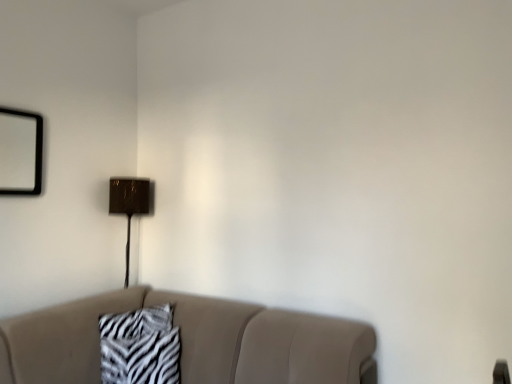
What do you see at coordinates (190, 342) in the screenshot?
I see `beige fabric couch at lower center` at bounding box center [190, 342].

The width and height of the screenshot is (512, 384). Identify the location of metallic gold table lamp at upper center. (129, 205).

How far apart are beige fabric couch at lower center and metallic gold table lamp at upper center?

A distance of 31.84 inches exists between beige fabric couch at lower center and metallic gold table lamp at upper center.

From the picture: From a real-world perspective, is beige fabric couch at lower center beneath metallic gold table lamp at upper center?

Yes.

Are beige fabric couch at lower center and metallic gold table lamp at upper center located far from each other?

Actually, beige fabric couch at lower center and metallic gold table lamp at upper center are a little close together.

Does zebra-patterned fabric at center have a smaller size compared to beige fabric couch at lower center?

Yes, zebra-patterned fabric at center is smaller than beige fabric couch at lower center.

Choose the correct answer: Is zebra-patterned fabric at center inside beige fabric couch at lower center or outside it?

zebra-patterned fabric at center is enclosed within beige fabric couch at lower center.

The height and width of the screenshot is (384, 512). In order to click on studio couch in front of the zebra-patterned fabric at center in this screenshot , I will do `click(190, 342)`.

From the image's perspective, relative to beige fabric couch at lower center, is zebra-patterned fabric at center above or below?

From the image's perspective, zebra-patterned fabric at center appears above beige fabric couch at lower center.

Based on the photo, could you tell me if metallic gold table lamp at upper center is turned towards beige fabric couch at lower center?

No.

From the image's perspective, is metallic gold table lamp at upper center under beige fabric couch at lower center?

No, from the image's perspective, metallic gold table lamp at upper center is not below beige fabric couch at lower center.

Does metallic gold table lamp at upper center have a lesser width compared to beige fabric couch at lower center?

Yes.

Between metallic gold table lamp at upper center and beige fabric couch at lower center, which one appears on the right side from the viewer's perspective?

beige fabric couch at lower center is more to the right.

Could you tell me if zebra-patterned fabric at center is turned towards metallic gold table lamp at upper center?

No, zebra-patterned fabric at center does not turn towards metallic gold table lamp at upper center.

Is zebra-patterned fabric at center bigger or smaller than metallic gold table lamp at upper center?

zebra-patterned fabric at center is smaller than metallic gold table lamp at upper center.

Would you say metallic gold table lamp at upper center is part of zebra-patterned fabric at center's contents?

No, metallic gold table lamp at upper center is not surrounded by zebra-patterned fabric at center.

From the image's perspective, relative to metallic gold table lamp at upper center, is zebra-patterned fabric at center above or below?

zebra-patterned fabric at center is situated lower than metallic gold table lamp at upper center in the image.

From a real-world perspective, is metallic gold table lamp at upper center over zebra-patterned fabric at center?

Yes.

Considering the relative sizes of metallic gold table lamp at upper center and zebra-patterned fabric at center in the image provided, is metallic gold table lamp at upper center thinner than zebra-patterned fabric at center?

Incorrect, the width of metallic gold table lamp at upper center is not less than that of zebra-patterned fabric at center.

Is zebra-patterned fabric at center completely or partially inside metallic gold table lamp at upper center?

No, metallic gold table lamp at upper center does not contain zebra-patterned fabric at center.

Is metallic gold table lamp at upper center bigger than zebra-patterned fabric at center?

Correct, metallic gold table lamp at upper center is larger in size than zebra-patterned fabric at center.

Is beige fabric couch at lower center far away from zebra-patterned fabric at center?

No, beige fabric couch at lower center is in close proximity to zebra-patterned fabric at center.

Visually, is beige fabric couch at lower center positioned to the left or to the right of zebra-patterned fabric at center?

From the image, it's evident that beige fabric couch at lower center is to the right of zebra-patterned fabric at center.

Which object is wider, beige fabric couch at lower center or zebra-patterned fabric at center?

beige fabric couch at lower center is wider.

Considering the sizes of objects beige fabric couch at lower center and zebra-patterned fabric at center in the image provided, who is shorter, beige fabric couch at lower center or zebra-patterned fabric at center?

zebra-patterned fabric at center.

Image resolution: width=512 pixels, height=384 pixels. Find the location of `studio couch below the metallic gold table lamp at upper center (from the image's perspective)`. studio couch below the metallic gold table lamp at upper center (from the image's perspective) is located at coordinates (190, 342).

Find the location of a particular element. The height and width of the screenshot is (384, 512). pillow that appears behind the beige fabric couch at lower center is located at coordinates (140, 347).

Considering their positions, is metallic gold table lamp at upper center positioned closer to beige fabric couch at lower center than zebra-patterned fabric at center?

zebra-patterned fabric at center lies closer to beige fabric couch at lower center than the other object.

Considering their positions, is zebra-patterned fabric at center positioned further to metallic gold table lamp at upper center than beige fabric couch at lower center?

The object further to metallic gold table lamp at upper center is beige fabric couch at lower center.

Estimate the real-world distances between objects in this image. Which object is further from beige fabric couch at lower center, zebra-patterned fabric at center or metallic gold table lamp at upper center?

metallic gold table lamp at upper center is positioned further to the anchor beige fabric couch at lower center.

From the image, which object appears to be farther from zebra-patterned fabric at center, beige fabric couch at lower center or metallic gold table lamp at upper center?

metallic gold table lamp at upper center is further to zebra-patterned fabric at center.

Which object lies nearer to the anchor point metallic gold table lamp at upper center, beige fabric couch at lower center or zebra-patterned fabric at center?

zebra-patterned fabric at center.

Looking at the image, which one is located further to zebra-patterned fabric at center, metallic gold table lamp at upper center or beige fabric couch at lower center?

metallic gold table lamp at upper center is further to zebra-patterned fabric at center.

Where is `pillow between beige fabric couch at lower center and metallic gold table lamp at upper center in the front-back direction`? pillow between beige fabric couch at lower center and metallic gold table lamp at upper center in the front-back direction is located at coordinates (140, 347).